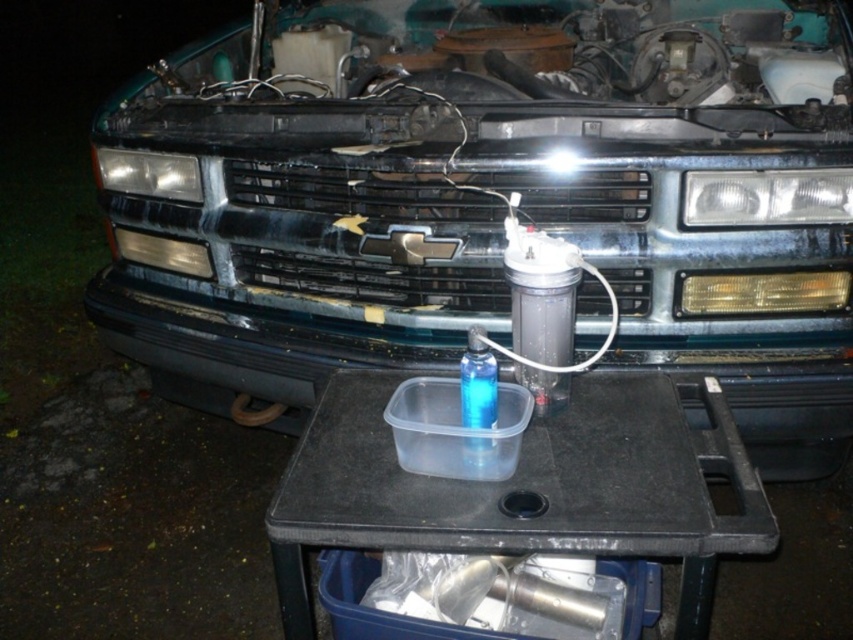
Based on the photo, you are a mechanic working on a Chevrolet vehicle at night. You need to locate the matte black headlight at left. Where exactly is it positioned on the car?

The matte black headlight at left is positioned at point coordinates of 0.272 on the x axis and 0.175 on the y axis.

You are a mechanic working on a Chevrolet vehicle at night. You need to access the Chevrolet logo on the grille while the black plastic table at center and transparent plastic bottle at center are in the way. Which object should you move first to reach the logo?

The transparent plastic bottle at center should be moved first because the black plastic table at center is taller than it, meaning the bottle is lower and easier to move out of the way.

You are a mechanic working on the Chevrolet vehicle at night. You need to replace a headlight. The two options available are the matte black headlight at left and the matte plastic headlight at left. Which one should you choose if you want the one that is bigger in size?

The matte black headlight at left is larger in size than the matte plastic headlight at left, so you should choose the matte black headlight at left.